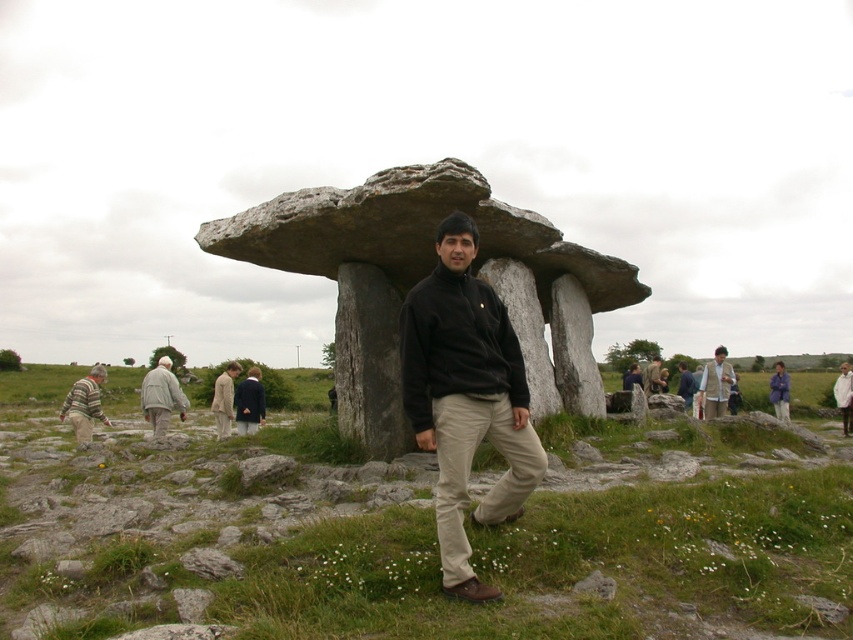
Can you confirm if rough stone structure at center is bigger than striped sweater at left?

Incorrect, rough stone structure at center is not larger than striped sweater at left.

Can you confirm if rough stone structure at center is smaller than striped sweater at left?

Correct, rough stone structure at center occupies less space than striped sweater at left.

Between point (312, 260) and point (64, 401), which one is positioned behind?

Point (64, 401)

Where is `rough stone structure at center`? The height and width of the screenshot is (640, 853). rough stone structure at center is located at coordinates 427,273.

You are a GUI agent. You are given a task and a screenshot of the screen. Output one action in this format:
    pyautogui.click(x=<x>, y=<y>)
    Task: Click on the black fleece jacket at center
    
    Given the screenshot: What is the action you would take?
    pyautogui.click(x=466, y=397)

Can you confirm if black fleece jacket at center is positioned above light gray fabric jacket at left?

No.

Who is more forward, (431, 388) or (163, 394)?

Point (431, 388) is in front.

This screenshot has width=853, height=640. I want to click on black fleece jacket at center, so click(x=466, y=397).

Which is behind, point (531, 372) or point (519, 387)?

The point (531, 372) is behind.

Between rough stone structure at center and black fleece at center, which one is positioned higher?

black fleece at center

The height and width of the screenshot is (640, 853). Identify the location of rough stone structure at center. (427, 273).